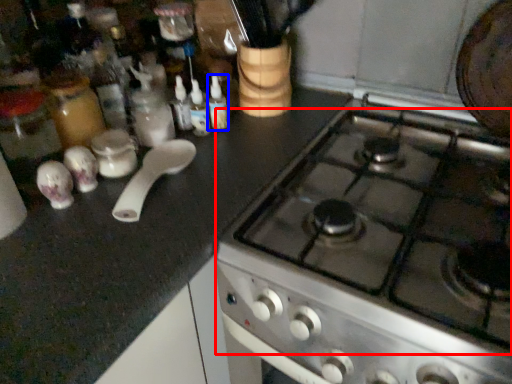
Question: Among these objects, which one is farthest to the camera, gas stove (highlighted by a red box) or bottle (highlighted by a blue box)?

Choices:
 (A) gas stove
 (B) bottle

Answer: (B)